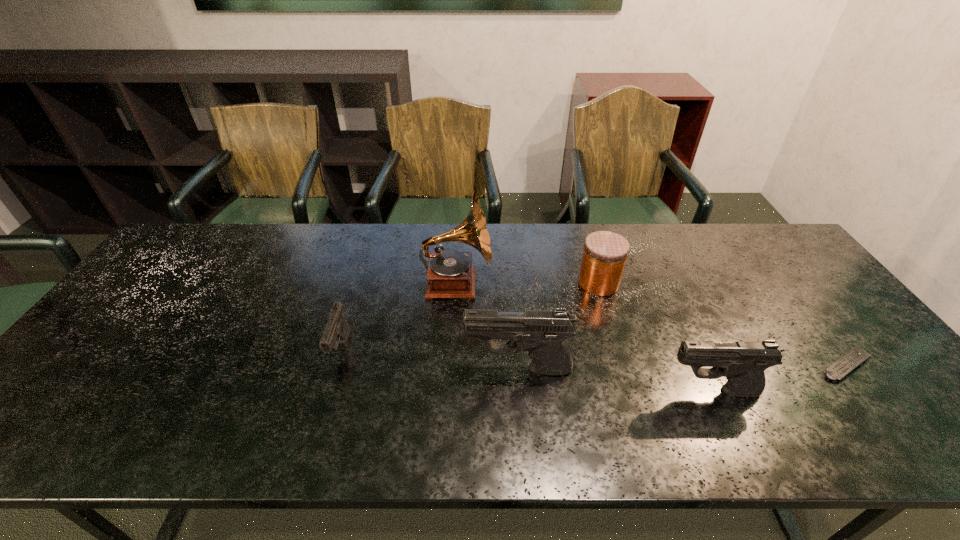
In the current image, all pistols are evenly spaced. To maintain this equal spacing, where should an additional pistol be placed on the left? Please point out a free spot. Please provide its 2D coordinates. Your answer should be formatted as a tuple, i.e. [(x, y)], where the tuple contains the x and y coordinates of a point satisfying the conditions above.

[(178, 330)]